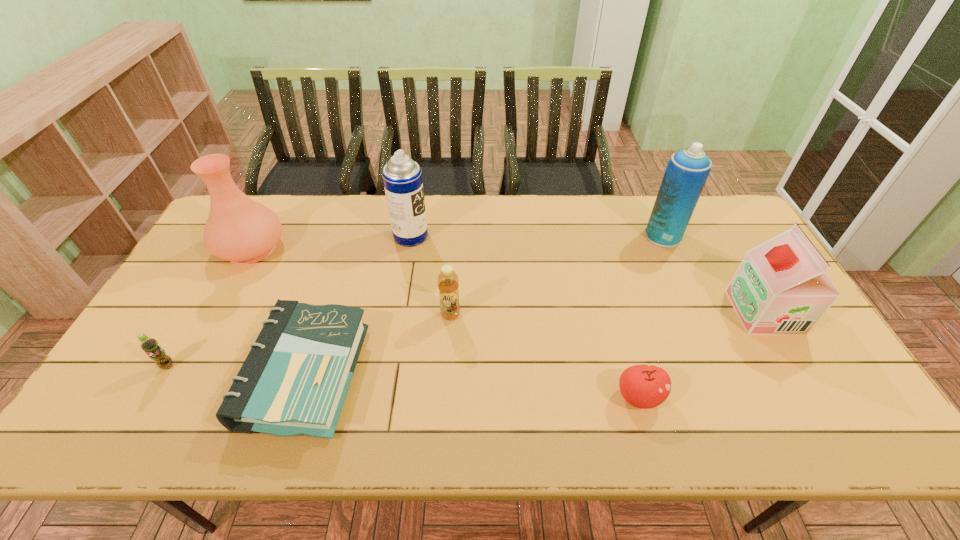
The width and height of the screenshot is (960, 540). Find the location of `paperback book`. paperback book is located at coordinates (294, 381).

The width and height of the screenshot is (960, 540). I want to click on free region located 0.110m on the right of the seventh object from left to right, so (x=715, y=235).

What are the coordinates of `free space located on the label side of the left aerosol can` in the screenshot? It's located at (510, 236).

The image size is (960, 540). Find the location of `blank area located on the right of the vase`. blank area located on the right of the vase is located at coordinates (382, 248).

The height and width of the screenshot is (540, 960). Find the location of `free space located with the cap open on the soya milk`. free space located with the cap open on the soya milk is located at coordinates tap(668, 312).

Where is `vacant space located with the cap open on the soya milk`? Image resolution: width=960 pixels, height=540 pixels. vacant space located with the cap open on the soya milk is located at coordinates (614, 312).

Find the location of a particular element. blank space located with the cap open on the soya milk is located at coordinates (607, 312).

You are a GUI agent. You are given a task and a screenshot of the screen. Output one action in this format:
    pyautogui.click(x=<x>, y=<y>)
    Task: Click on the vacant space located 0.170m on the front of the bottle
    This screenshot has height=540, width=960.
    Given the screenshot: What is the action you would take?
    pyautogui.click(x=446, y=377)

Where is `free space located on the front label of the soda`? This screenshot has height=540, width=960. free space located on the front label of the soda is located at coordinates (129, 434).

Image resolution: width=960 pixels, height=540 pixels. Identify the location of free spot located on the back of the apple. (609, 286).